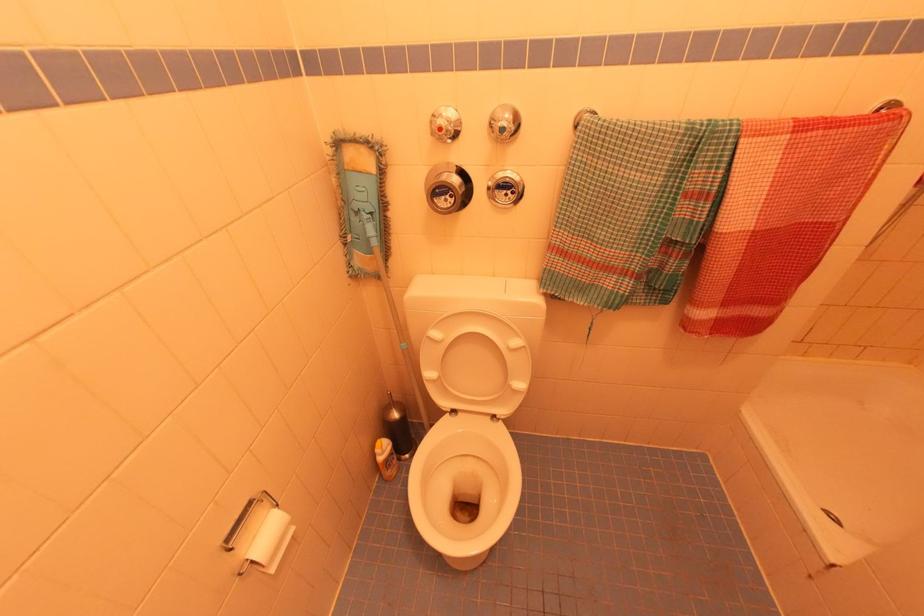
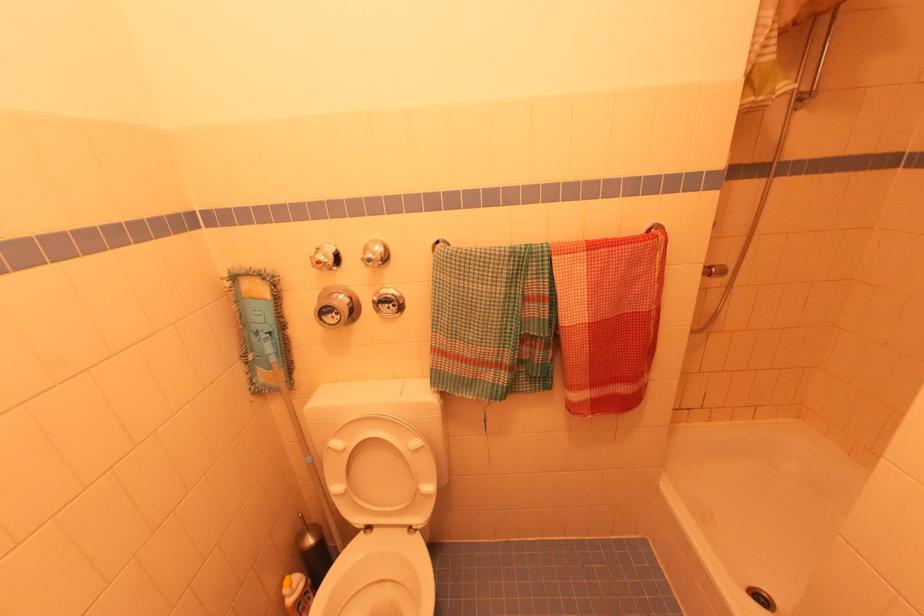
What movement of the cameraman would produce the second image?

The movement direction of the cameraman is right, backward.